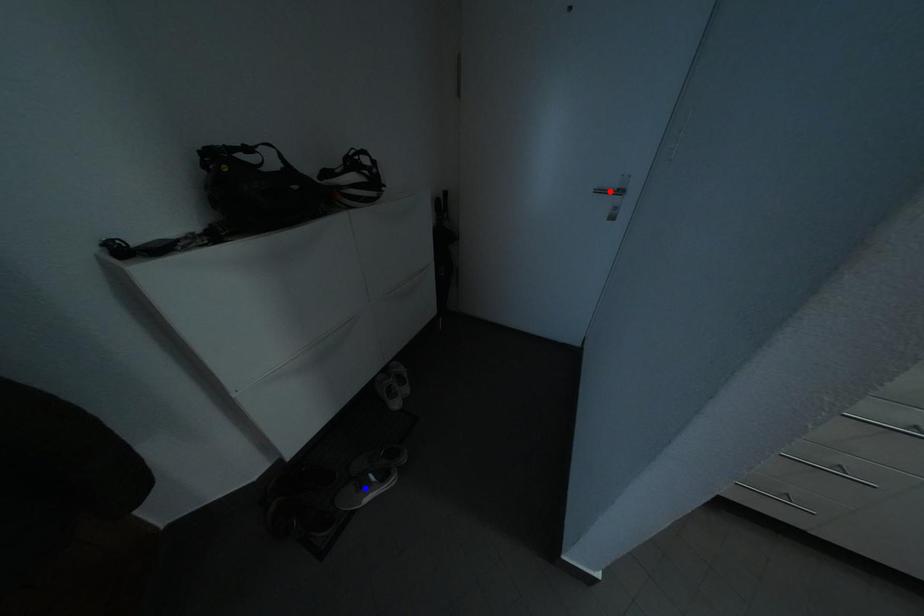
Question: Two points are marked on the image. Which point is closer to the camera?

Choices:
 (A) Blue point is closer.
 (B) Red point is closer.

Answer: (B)